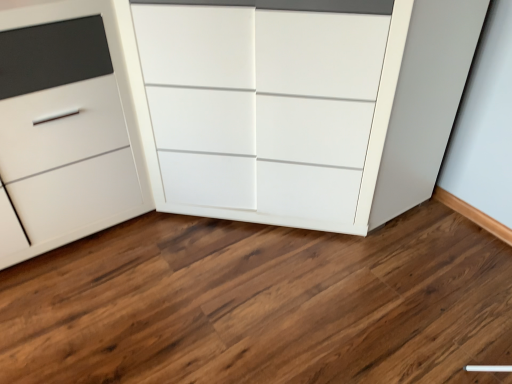
The height and width of the screenshot is (384, 512). Describe the element at coordinates (71, 133) in the screenshot. I see `white matte cabinet at lower left, arranged as the 1th chest of drawers when viewed from the left` at that location.

Identify the location of white matte cabinet at lower left, arranged as the 2th chest of drawers when viewed from the right. Image resolution: width=512 pixels, height=384 pixels. (71, 133).

Measure the distance between point [100,22] and camera.

Point [100,22] is 4.47 feet from camera.

Measure the distance between white glossy cabinet at center, the 2th chest of drawers viewed from the left, and camera.

white glossy cabinet at center, the 2th chest of drawers viewed from the left, is 3.95 feet from camera.

Locate an element on the screen. white glossy cabinet at center, the 2th chest of drawers viewed from the left is located at coordinates (292, 116).

This screenshot has width=512, height=384. What do you see at coordinates (292, 116) in the screenshot? I see `white glossy cabinet at center, the 2th chest of drawers viewed from the left` at bounding box center [292, 116].

Where is `white matte cabinet at lower left, arranged as the 2th chest of drawers when viewed from the right`? This screenshot has height=384, width=512. white matte cabinet at lower left, arranged as the 2th chest of drawers when viewed from the right is located at coordinates (71, 133).

Considering the positions of objects white glossy cabinet at center, the 2th chest of drawers viewed from the left, and white matte cabinet at lower left, arranged as the 1th chest of drawers when viewed from the left, in the image provided, who is more to the left, white glossy cabinet at center, the 2th chest of drawers viewed from the left, or white matte cabinet at lower left, arranged as the 1th chest of drawers when viewed from the left,?

white matte cabinet at lower left, arranged as the 1th chest of drawers when viewed from the left, is more to the left.

Is the depth of white glossy cabinet at center, the 2th chest of drawers viewed from the left, less than that of white matte cabinet at lower left, arranged as the 1th chest of drawers when viewed from the left?

Yes.

Considering the positions of point (367, 150) and point (11, 115), is point (367, 150) closer or farther from the camera than point (11, 115)?

Clearly, point (367, 150) is more distant from the camera than point (11, 115).

From the image's perspective, which one is positioned lower, white glossy cabinet at center, the first chest of drawers when ordered from right to left, or white matte cabinet at lower left, arranged as the 2th chest of drawers when viewed from the right?

white matte cabinet at lower left, arranged as the 2th chest of drawers when viewed from the right, appears lower in the image.

From a real-world perspective, is white glossy cabinet at center, the 2th chest of drawers viewed from the left, positioned above or below white matte cabinet at lower left, arranged as the 1th chest of drawers when viewed from the left?

From a real-world perspective, white glossy cabinet at center, the 2th chest of drawers viewed from the left, is physically above white matte cabinet at lower left, arranged as the 1th chest of drawers when viewed from the left.

Can you confirm if white glossy cabinet at center, the 2th chest of drawers viewed from the left, is wider than white matte cabinet at lower left, arranged as the 2th chest of drawers when viewed from the right?

Indeed, white glossy cabinet at center, the 2th chest of drawers viewed from the left, has a greater width compared to white matte cabinet at lower left, arranged as the 2th chest of drawers when viewed from the right.

In terms of height, does white glossy cabinet at center, the first chest of drawers when ordered from right to left, look taller or shorter compared to white matte cabinet at lower left, arranged as the 1th chest of drawers when viewed from the left?

Considering their sizes, white glossy cabinet at center, the first chest of drawers when ordered from right to left, has more height than white matte cabinet at lower left, arranged as the 1th chest of drawers when viewed from the left.

In terms of size, does white glossy cabinet at center, the first chest of drawers when ordered from right to left, appear bigger or smaller than white matte cabinet at lower left, arranged as the 1th chest of drawers when viewed from the left?

Considering their sizes, white glossy cabinet at center, the first chest of drawers when ordered from right to left, takes up more space than white matte cabinet at lower left, arranged as the 1th chest of drawers when viewed from the left.

Is white glossy cabinet at center, the 2th chest of drawers viewed from the left, completely or partially outside of white matte cabinet at lower left, arranged as the 2th chest of drawers when viewed from the right?

Yes, white glossy cabinet at center, the 2th chest of drawers viewed from the left, is not within white matte cabinet at lower left, arranged as the 2th chest of drawers when viewed from the right.

Is white glossy cabinet at center, the first chest of drawers when ordered from right to left, next to white matte cabinet at lower left, arranged as the 2th chest of drawers when viewed from the right?

No, white glossy cabinet at center, the first chest of drawers when ordered from right to left, is not with white matte cabinet at lower left, arranged as the 2th chest of drawers when viewed from the right.

In the scene shown: Is white glossy cabinet at center, the 2th chest of drawers viewed from the left, aimed at white matte cabinet at lower left, arranged as the 1th chest of drawers when viewed from the left?

No, white glossy cabinet at center, the 2th chest of drawers viewed from the left, is not turned towards white matte cabinet at lower left, arranged as the 1th chest of drawers when viewed from the left.

How many degrees apart are the facing directions of white glossy cabinet at center, the 2th chest of drawers viewed from the left, and white matte cabinet at lower left, arranged as the 2th chest of drawers when viewed from the right?

There is a 9.88e-06-degree angle between the facing directions of white glossy cabinet at center, the 2th chest of drawers viewed from the left, and white matte cabinet at lower left, arranged as the 2th chest of drawers when viewed from the right.

How distant is white glossy cabinet at center, the first chest of drawers when ordered from right to left, from white matte cabinet at lower left, arranged as the 1th chest of drawers when viewed from the left?

white glossy cabinet at center, the first chest of drawers when ordered from right to left, is 11.23 inches from white matte cabinet at lower left, arranged as the 1th chest of drawers when viewed from the left.

Where is `the chest of drawers that is in front of the white matte cabinet at lower left, arranged as the 1th chest of drawers when viewed from the left`? the chest of drawers that is in front of the white matte cabinet at lower left, arranged as the 1th chest of drawers when viewed from the left is located at coordinates (292, 116).

Is white matte cabinet at lower left, arranged as the 2th chest of drawers when viewed from the right, at the right side of white glossy cabinet at center, the 2th chest of drawers viewed from the left?

No, white matte cabinet at lower left, arranged as the 2th chest of drawers when viewed from the right, is not to the right of white glossy cabinet at center, the 2th chest of drawers viewed from the left.

Consider the image. Is white matte cabinet at lower left, arranged as the 2th chest of drawers when viewed from the right, behind white glossy cabinet at center, the first chest of drawers when ordered from right to left?

Yes, white matte cabinet at lower left, arranged as the 2th chest of drawers when viewed from the right, is behind white glossy cabinet at center, the first chest of drawers when ordered from right to left.

Is point (55, 102) closer to viewer compared to point (227, 214)?

Yes, it is in front of point (227, 214).

From the image's perspective, is white matte cabinet at lower left, arranged as the 1th chest of drawers when viewed from the left, under white glossy cabinet at center, the first chest of drawers when ordered from right to left?

Yes, from the image's perspective, white matte cabinet at lower left, arranged as the 1th chest of drawers when viewed from the left, is beneath white glossy cabinet at center, the first chest of drawers when ordered from right to left.

From a real-world perspective, is white matte cabinet at lower left, arranged as the 1th chest of drawers when viewed from the left, above or below white glossy cabinet at center, the 2th chest of drawers viewed from the left?

Clearly, from a real-world perspective, white matte cabinet at lower left, arranged as the 1th chest of drawers when viewed from the left, is below white glossy cabinet at center, the 2th chest of drawers viewed from the left.

Looking at their sizes, would you say white matte cabinet at lower left, arranged as the 1th chest of drawers when viewed from the left, is wider or thinner than white glossy cabinet at center, the 2th chest of drawers viewed from the left?

Considering their sizes, white matte cabinet at lower left, arranged as the 1th chest of drawers when viewed from the left, looks slimmer than white glossy cabinet at center, the 2th chest of drawers viewed from the left.

Considering the sizes of objects white matte cabinet at lower left, arranged as the 1th chest of drawers when viewed from the left, and white glossy cabinet at center, the first chest of drawers when ordered from right to left, in the image provided, who is taller, white matte cabinet at lower left, arranged as the 1th chest of drawers when viewed from the left, or white glossy cabinet at center, the first chest of drawers when ordered from right to left,?

white glossy cabinet at center, the first chest of drawers when ordered from right to left, is taller.

Based on their sizes in the image, would you say white matte cabinet at lower left, arranged as the 1th chest of drawers when viewed from the left, is bigger or smaller than white glossy cabinet at center, the first chest of drawers when ordered from right to left?

white matte cabinet at lower left, arranged as the 1th chest of drawers when viewed from the left, is smaller than white glossy cabinet at center, the first chest of drawers when ordered from right to left.

Is white glossy cabinet at center, the 2th chest of drawers viewed from the left, completely or partially inside white matte cabinet at lower left, arranged as the 2th chest of drawers when viewed from the right?

Actually, white glossy cabinet at center, the 2th chest of drawers viewed from the left, is outside white matte cabinet at lower left, arranged as the 2th chest of drawers when viewed from the right.

Is white matte cabinet at lower left, arranged as the 1th chest of drawers when viewed from the left, directly adjacent to white glossy cabinet at center, the 2th chest of drawers viewed from the left?

No, white matte cabinet at lower left, arranged as the 1th chest of drawers when viewed from the left, is not beside white glossy cabinet at center, the 2th chest of drawers viewed from the left.

Could you tell me if white matte cabinet at lower left, arranged as the 1th chest of drawers when viewed from the left, is turned towards white glossy cabinet at center, the first chest of drawers when ordered from right to left?

No, white matte cabinet at lower left, arranged as the 1th chest of drawers when viewed from the left, is not oriented towards white glossy cabinet at center, the first chest of drawers when ordered from right to left.

Can you tell me how much white matte cabinet at lower left, arranged as the 2th chest of drawers when viewed from the right, and white glossy cabinet at center, the 2th chest of drawers viewed from the left, differ in facing direction?

They differ by 9.88e-06 degrees in their facing directions.

Measure the distance between white matte cabinet at lower left, arranged as the 2th chest of drawers when viewed from the right, and white glossy cabinet at center, the 2th chest of drawers viewed from the left.

A distance of 11.23 inches exists between white matte cabinet at lower left, arranged as the 2th chest of drawers when viewed from the right, and white glossy cabinet at center, the 2th chest of drawers viewed from the left.

Image resolution: width=512 pixels, height=384 pixels. What are the coordinates of `chest of drawers in front of the white matte cabinet at lower left, arranged as the 1th chest of drawers when viewed from the left` in the screenshot? It's located at (292, 116).

The height and width of the screenshot is (384, 512). I want to click on the chest of drawers behind the white glossy cabinet at center, the 2th chest of drawers viewed from the left, so click(x=71, y=133).

Image resolution: width=512 pixels, height=384 pixels. I want to click on chest of drawers on the right of white matte cabinet at lower left, arranged as the 1th chest of drawers when viewed from the left, so click(x=292, y=116).